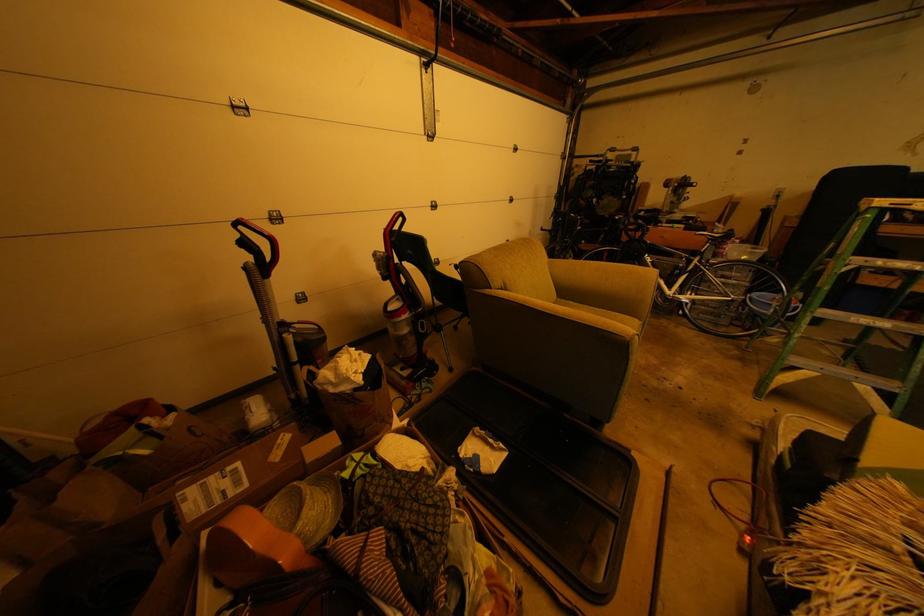
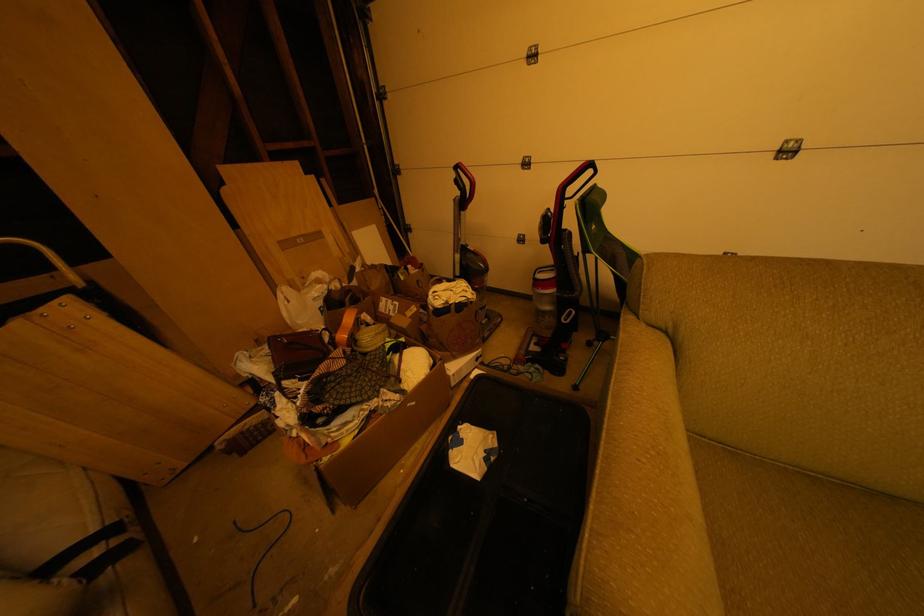
Based on the continuous images, in which direction is the camera rotating?

The rotation direction of the camera is left-down.